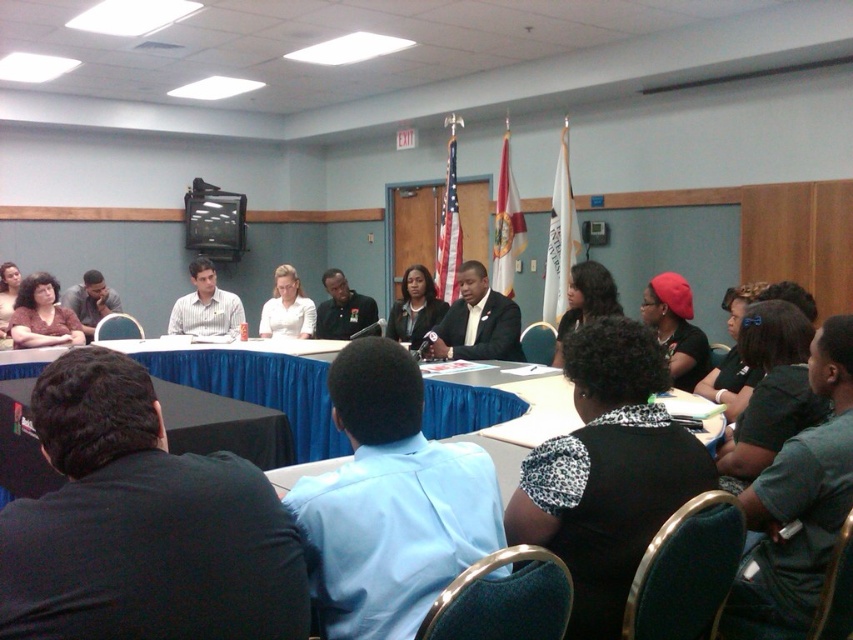
Is point (399, 333) more distant than point (271, 324)?

No, it is not.

Does matte black blazer at center appear under white glossy shirt at center?

Yes.

Identify the location of matte black blazer at center. This screenshot has height=640, width=853. (415, 307).

Locate an element on the screen. matte black blazer at center is located at coordinates (415, 307).

Which is in front, point (694, 342) or point (746, 296)?

Point (746, 296) is in front.

Between matte red beanie at center and black fabric headband at upper right, which one appears on the right side from the viewer's perspective?

From the viewer's perspective, black fabric headband at upper right appears more on the right side.

Is point (671, 314) closer to viewer compared to point (755, 372)?

That is False.

The width and height of the screenshot is (853, 640). I want to click on matte red beanie at center, so click(675, 328).

Is point (569, 312) behind point (305, 308)?

No, it is not.

Does dark brown hair at center have a larger size compared to white glossy shirt at center?

Correct, dark brown hair at center is larger in size than white glossy shirt at center.

Identify the location of dark brown hair at center. (585, 300).